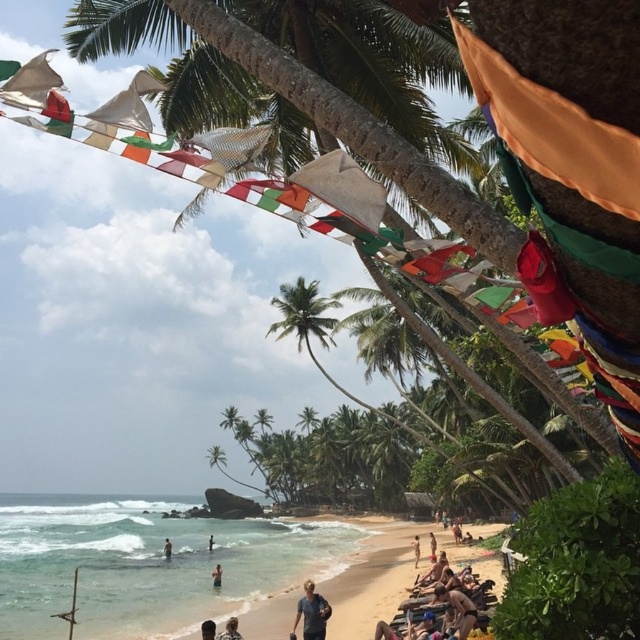
You are standing on the beach and want to hand a towel to the person wearing the dark blue shirt at lower center. If you can throw a towel 10 meters, will you be able to reach them?

The dark blue shirt at lower center and viewer are 11.17 meters apart, so you cannot reach them with a 10 meter throw.

You are standing at the beach and want to reach both the point at coordinates point (228, 621) and the point at coordinates point (416, 550). Which point will you reach first if you walk straight ahead?

You will reach the point at coordinates point (228, 621) first because it is closer to you than the point at coordinates point (416, 550).